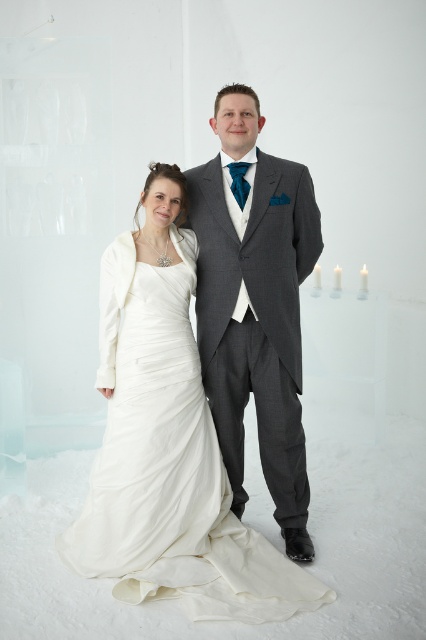
Who is taller, ivory satin dress at center or gray wool suit at center?

gray wool suit at center is taller.

Is ivory satin dress at center positioned in front of gray wool suit at center?

Yes, ivory satin dress at center is in front of gray wool suit at center.

Who is more forward, (152,314) or (294,513)?

Positioned in front is point (152,314).

What are the coordinates of `ivory satin dress at center` in the screenshot? It's located at (169, 464).

Can you confirm if ivory satin dress at center is positioned to the right of satin white dress at center?

Indeed, ivory satin dress at center is positioned on the right side of satin white dress at center.

Does point (201, 538) lie in front of point (149, 220)?

Yes.

This screenshot has width=426, height=640. Find the location of `ivory satin dress at center`. ivory satin dress at center is located at coordinates (169, 464).

How far apart are satin white dress at center and gray wool suit at center?

satin white dress at center is 10.69 inches from gray wool suit at center.

Can you confirm if satin white dress at center is wider than gray wool suit at center?

Yes, satin white dress at center is wider than gray wool suit at center.

Where is `satin white dress at center`? Image resolution: width=426 pixels, height=640 pixels. satin white dress at center is located at coordinates (149, 403).